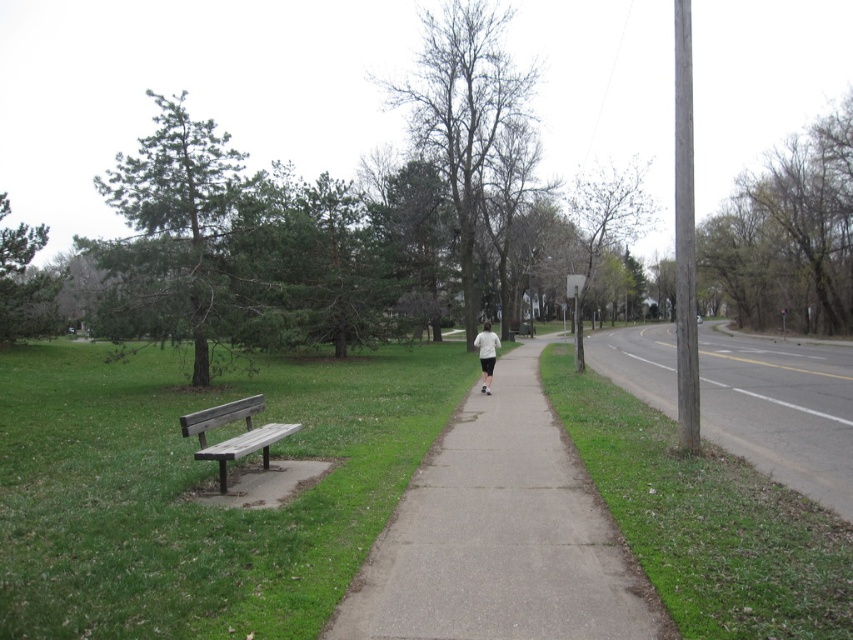
Question: Which object is farther from the camera taking this photo?

Choices:
 (A) gray asphalt road at right
 (B) white matte shirt at center

Answer: (B)

Question: Which object is positioned farthest from the gray asphalt road at right?

Choices:
 (A) wooden bench at left
 (B) gray concrete sidewalk at center
 (C) white matte shirt at center

Answer: (A)

Question: Is gray asphalt road at right to the left of white matte shirt at center from the viewer's perspective?

Choices:
 (A) yes
 (B) no

Answer: (B)

Question: In this image, where is gray asphalt road at right located relative to wooden bench at left?

Choices:
 (A) above
 (B) below

Answer: (A)

Question: Does gray concrete sidewalk at center appear under white matte shirt at center?

Choices:
 (A) no
 (B) yes

Answer: (B)

Question: Among these points, which one is nearest to the camera?

Choices:
 (A) (518, 563)
 (B) (218, 417)
 (C) (781, 380)
 (D) (485, 348)

Answer: (A)